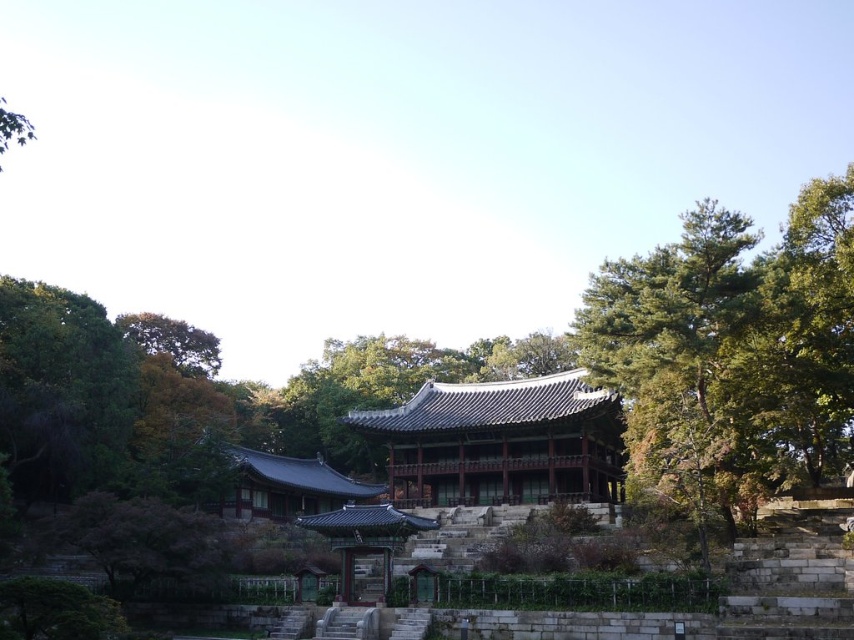
You are standing at the entrance of the traditional Korean building and want to walk towards the point that is closer to you. Which point should you head towards, point (664, 445) or point (434, 429)?

You should head towards point (664, 445) because it is closer to the viewer than point (434, 429).

You are standing at the entrance of the temple complex and want to take a photo of the shiny dark brown wooden temple at center. Which direction should you face to ensure the temple is in the center of your photo?

The shiny dark brown wooden temple at center is located at point (500, 442), so you should face towards the coordinates (500, 442) to center it in your photo.

You are standing at the entrance of the traditional Korean building and want to take a photo of the point at coordinate (650,285). The camera you have can focus on objects up to 50 meters away. Will the point be in focus?

The point at coordinate (650,285) is 48.84 meters from the camera, which is within the 50 meters focus range. Therefore, the point will be in focus.